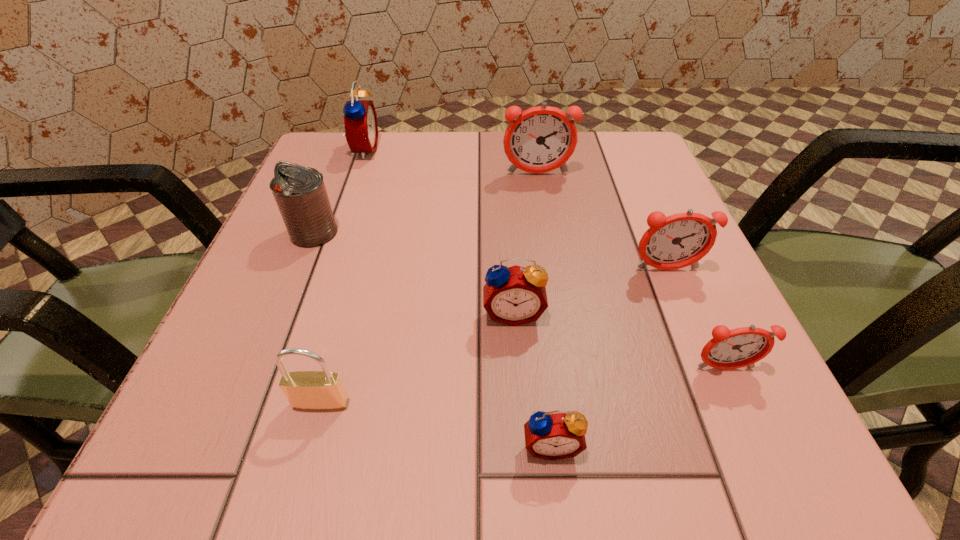
Identify the location of vacant space located 0.120m on the front-facing side of the smallest reddish-pink alarm clock. (769, 468).

I want to click on padlock situated at the near edge, so click(x=323, y=390).

You are a GUI agent. You are given a task and a screenshot of the screen. Output one action in this format:
    pyautogui.click(x=<x>, y=<y>)
    Task: Click on the alarm clock located at the near edge
    
    Given the screenshot: What is the action you would take?
    pyautogui.click(x=555, y=435)

Identify the location of alarm clock present at the left edge. This screenshot has height=540, width=960. (360, 118).

Locate an element on the screen. can located in the left edge section of the desktop is located at coordinates (299, 191).

Locate an element on the screen. This screenshot has height=540, width=960. padlock present at the left edge is located at coordinates (323, 390).

This screenshot has height=540, width=960. I want to click on object that is at the far left corner, so click(x=360, y=118).

This screenshot has width=960, height=540. In order to click on object positioned at the near left corner in this screenshot , I will do [323, 390].

In order to click on blank area at the far edge in this screenshot , I will do `click(458, 154)`.

Where is `vacant region at the near edge of the desktop`? vacant region at the near edge of the desktop is located at coordinates (334, 473).